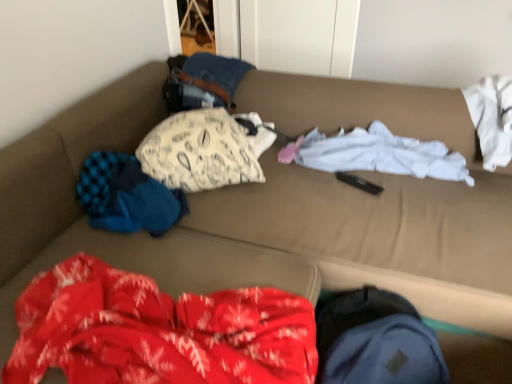
Question: From the image's perspective, is white cotton shirt at center, which appears as the 3th clothing when viewed from the left, on white printed pillow at center, the second clothing from the right?

Choices:
 (A) yes
 (B) no

Answer: (B)

Question: Considering the relative sizes of white cotton shirt at center, which appears as the 3th clothing when viewed from the left, and white printed pillow at center, the second clothing from the right, in the image provided, is white cotton shirt at center, which appears as the 3th clothing when viewed from the left, wider than white printed pillow at center, the second clothing from the right,?

Choices:
 (A) yes
 (B) no

Answer: (B)

Question: Are white cotton shirt at center, which appears as the 3th clothing when viewed from the left, and white printed pillow at center, the 2th clothing positioned from the left, located far from each other?

Choices:
 (A) no
 (B) yes

Answer: (A)

Question: Considering the relative sizes of white cotton shirt at center, which appears as the 3th clothing when viewed from the left, and white printed pillow at center, the second clothing from the right, in the image provided, is white cotton shirt at center, which appears as the 3th clothing when viewed from the left, taller than white printed pillow at center, the second clothing from the right,?

Choices:
 (A) no
 (B) yes

Answer: (A)

Question: From a real-world perspective, is white cotton shirt at center, the first clothing in the right-to-left sequence, on white printed pillow at center, the second clothing from the right?

Choices:
 (A) no
 (B) yes

Answer: (A)

Question: Can you confirm if white cotton shirt at center, which appears as the 3th clothing when viewed from the left, is shorter than white printed pillow at center, the 2th clothing positioned from the left?

Choices:
 (A) no
 (B) yes

Answer: (B)

Question: From a real-world perspective, is white printed pillow at center, the 2th clothing positioned from the left, positioned under white cotton shirt at center, which appears as the 3th clothing when viewed from the left, based on gravity?

Choices:
 (A) yes
 (B) no

Answer: (B)

Question: Is white cotton shirt at center, which appears as the 3th clothing when viewed from the left, a part of white printed pillow at center, the second clothing from the right?

Choices:
 (A) yes
 (B) no

Answer: (B)

Question: Considering the relative positions of white printed pillow at center, the second clothing from the right, and white cotton shirt at center, which appears as the 3th clothing when viewed from the left, in the image provided, is white printed pillow at center, the second clothing from the right, behind white cotton shirt at center, which appears as the 3th clothing when viewed from the left,?

Choices:
 (A) yes
 (B) no

Answer: (B)

Question: Can you confirm if white printed pillow at center, the 2th clothing positioned from the left, is positioned to the right of white cotton shirt at center, which appears as the 3th clothing when viewed from the left?

Choices:
 (A) no
 (B) yes

Answer: (A)

Question: Considering the relative sizes of white printed pillow at center, the 2th clothing positioned from the left, and white cotton shirt at center, which appears as the 3th clothing when viewed from the left, in the image provided, is white printed pillow at center, the 2th clothing positioned from the left, smaller than white cotton shirt at center, which appears as the 3th clothing when viewed from the left,?

Choices:
 (A) no
 (B) yes

Answer: (A)

Question: Considering the relative sizes of white printed pillow at center, the second clothing from the right, and white cotton shirt at center, the first clothing in the right-to-left sequence, in the image provided, is white printed pillow at center, the second clothing from the right, shorter than white cotton shirt at center, the first clothing in the right-to-left sequence,?

Choices:
 (A) yes
 (B) no

Answer: (B)

Question: Considering the relative positions of white printed pillow at center, the second clothing from the right, and blue knitted sweater at left, the 3th clothing when ordered from right to left, in the image provided, is white printed pillow at center, the second clothing from the right, to the left of blue knitted sweater at left, the 3th clothing when ordered from right to left, from the viewer's perspective?

Choices:
 (A) no
 (B) yes

Answer: (A)